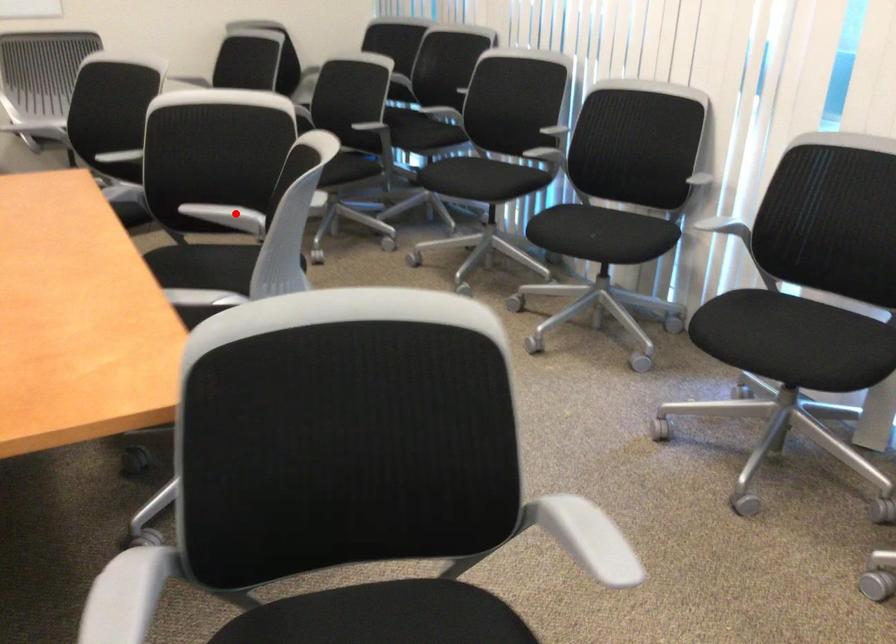
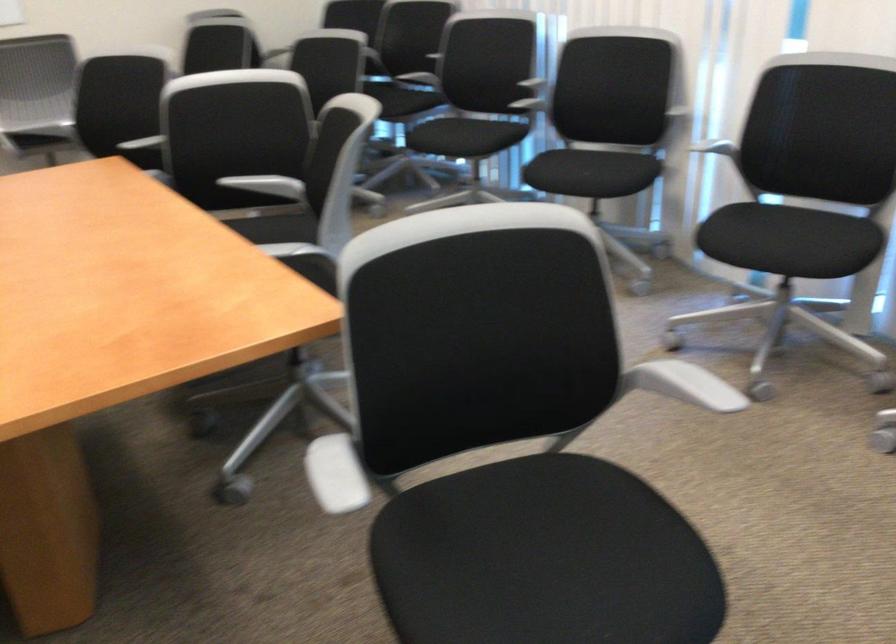
Find the pixel in the second image that matches the highlighted location in the first image.

(268, 185)